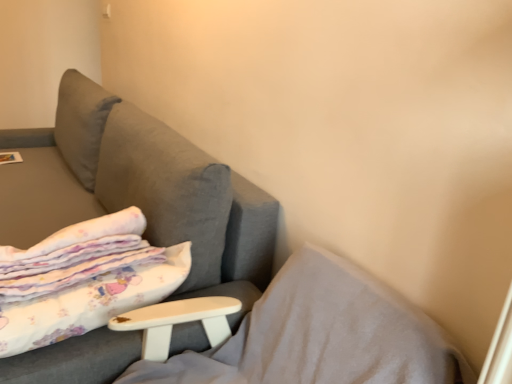
The image size is (512, 384). Find the location of `vacant area on top of matte white magazine at upper left (from a real-world perspective)`. vacant area on top of matte white magazine at upper left (from a real-world perspective) is located at coordinates (8, 157).